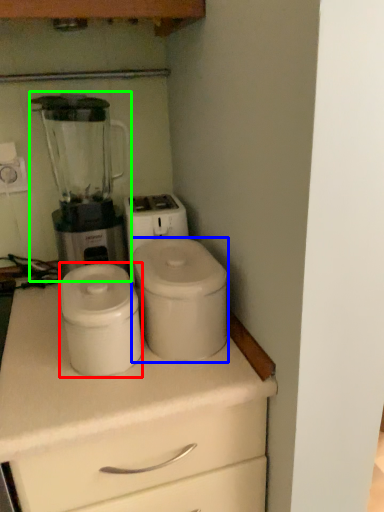
Question: Based on their relative distances, which object is nearer to appliance (highlighted by a red box)? Choose from appliance (highlighted by a blue box) and blender (highlighted by a green box).

Choices:
 (A) appliance
 (B) blender

Answer: (A)